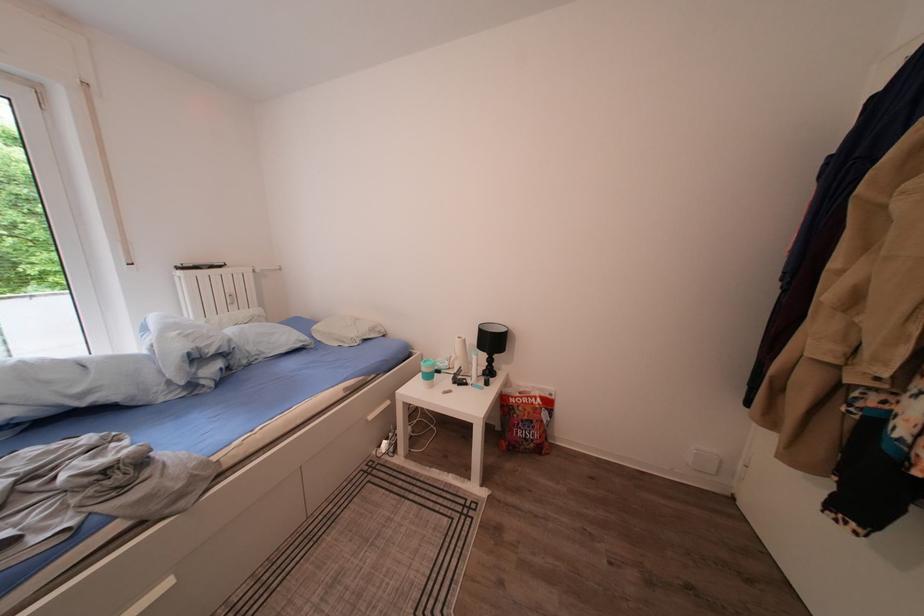
This screenshot has height=616, width=924. What do you see at coordinates (460, 353) in the screenshot? I see `a white pump dispenser top` at bounding box center [460, 353].